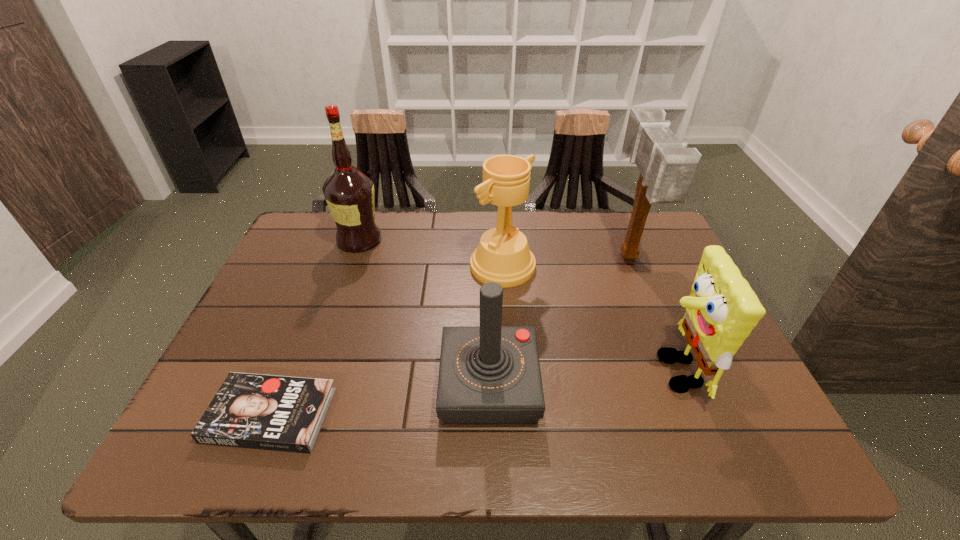
Locate an element on the screen. This screenshot has width=960, height=540. alcohol is located at coordinates coord(349,193).

Where is `mallet`? The height and width of the screenshot is (540, 960). mallet is located at coordinates (667, 167).

Where is `award`? The height and width of the screenshot is (540, 960). award is located at coordinates (503, 256).

The height and width of the screenshot is (540, 960). Identify the location of sponge. (721, 311).

Find the location of `joystick`. joystick is located at coordinates (490, 374).

Locate an element on the screen. This screenshot has width=960, height=540. the shortest object is located at coordinates (282, 413).

This screenshot has height=540, width=960. I want to click on blank space located 0.150m on the label of the alcohol, so click(432, 240).

This screenshot has height=540, width=960. I want to click on vacant space located 0.070m on the right of the mallet, so click(x=667, y=258).

Locate an element on the screen. The width and height of the screenshot is (960, 540). vacant area located 0.280m on the left of the award is located at coordinates (370, 266).

The width and height of the screenshot is (960, 540). I want to click on free space located 0.060m on the face of the sponge, so click(x=625, y=372).